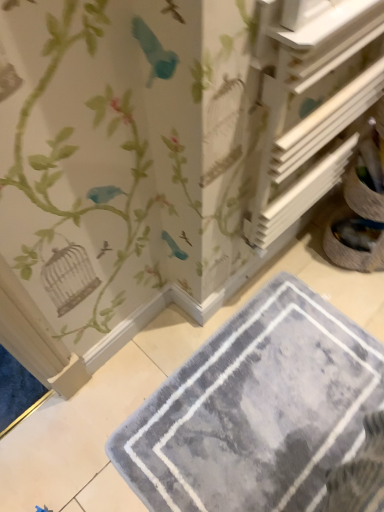
Question: Can you confirm if gray plush bath mat at lower center is thinner than white wood shelf at upper right?

Choices:
 (A) yes
 (B) no

Answer: (B)

Question: From the image's perspective, would you say gray plush bath mat at lower center is positioned over white wood shelf at upper right?

Choices:
 (A) yes
 (B) no

Answer: (B)

Question: From the image's perspective, is gray plush bath mat at lower center under white wood shelf at upper right?

Choices:
 (A) yes
 (B) no

Answer: (A)

Question: Is gray plush bath mat at lower center next to white wood shelf at upper right?

Choices:
 (A) no
 (B) yes

Answer: (A)

Question: Is gray plush bath mat at lower center positioned in front of white wood shelf at upper right?

Choices:
 (A) yes
 (B) no

Answer: (B)

Question: Can you confirm if gray plush bath mat at lower center is wider than white wood shelf at upper right?

Choices:
 (A) yes
 (B) no

Answer: (A)

Question: Is white wood shelf at upper right outside of gray plush bath mat at lower center?

Choices:
 (A) no
 (B) yes

Answer: (B)

Question: Does white wood shelf at upper right have a greater width compared to gray plush bath mat at lower center?

Choices:
 (A) yes
 (B) no

Answer: (B)

Question: From a real-world perspective, is white wood shelf at upper right positioned under gray plush bath mat at lower center based on gravity?

Choices:
 (A) yes
 (B) no

Answer: (B)

Question: Is white wood shelf at upper right to the left of gray plush bath mat at lower center from the viewer's perspective?

Choices:
 (A) yes
 (B) no

Answer: (B)

Question: Could you tell me if white wood shelf at upper right is turned towards gray plush bath mat at lower center?

Choices:
 (A) no
 (B) yes

Answer: (A)

Question: Considering the relative sizes of white wood shelf at upper right and gray plush bath mat at lower center in the image provided, is white wood shelf at upper right shorter than gray plush bath mat at lower center?

Choices:
 (A) yes
 (B) no

Answer: (B)

Question: Looking at their shapes, would you say white wood shelf at upper right is wider or thinner than gray plush bath mat at lower center?

Choices:
 (A) thin
 (B) wide

Answer: (A)